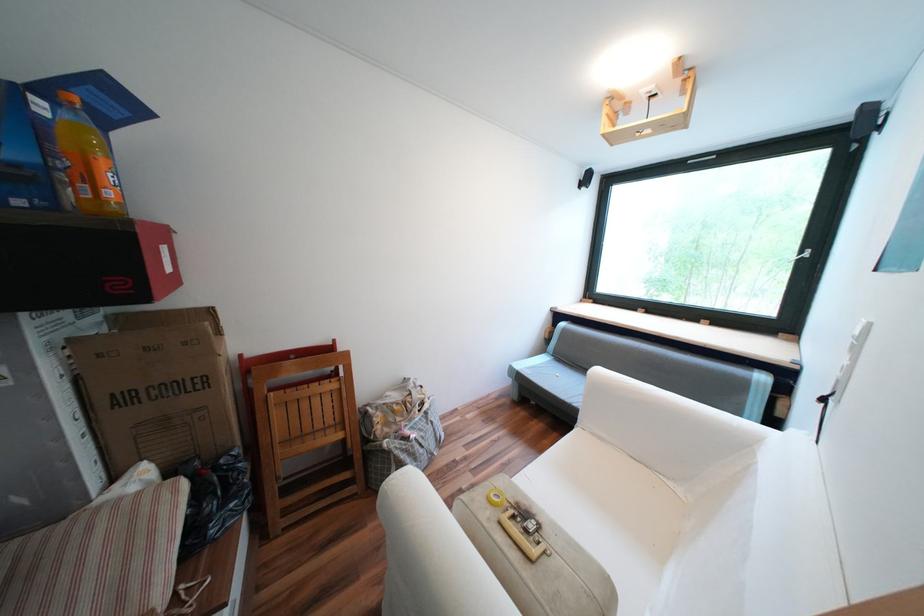
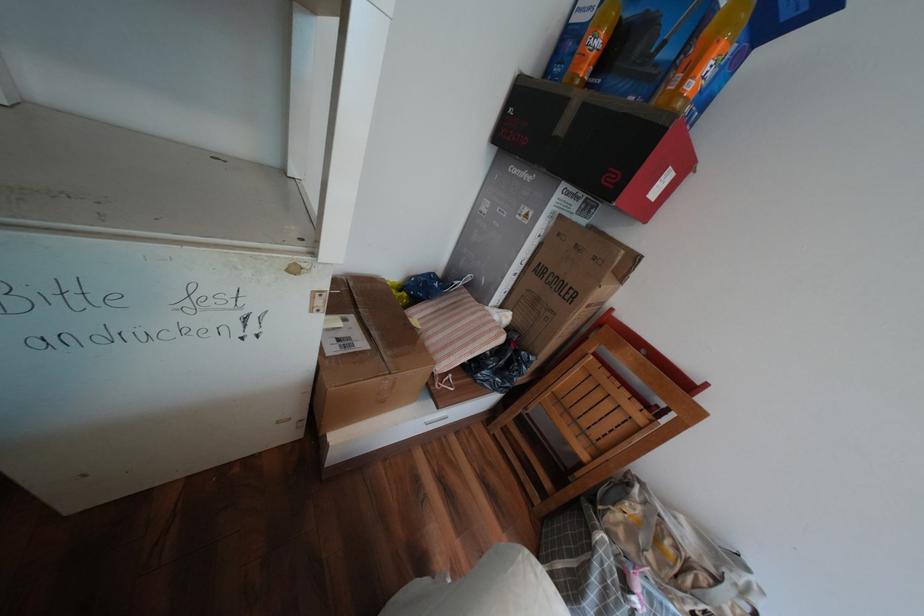
Based on the continuous images, in which direction is the camera rotating?

The rotation direction of the camera is left-down.